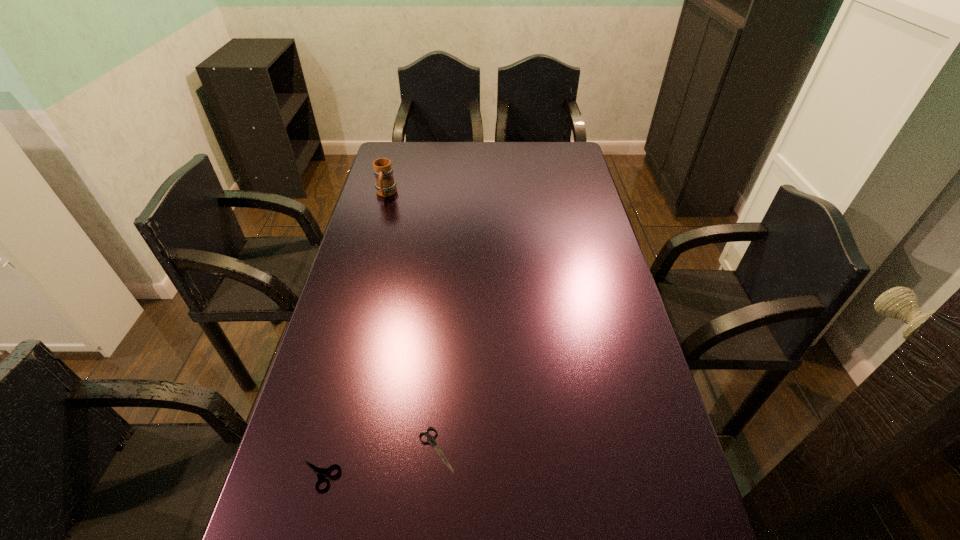
Locate an element on the screen. free space between the tallest object and the shorter shears is located at coordinates (411, 321).

Identify the location of vacant space in between the taller shears and the farthest object. The image size is (960, 540). (353, 335).

Identify the location of vacant point located between the taller shears and the shorter shears. (378, 463).

Where is `vacant space that is in between the farthest object and the left shears`? This screenshot has height=540, width=960. vacant space that is in between the farthest object and the left shears is located at coordinates (353, 335).

The width and height of the screenshot is (960, 540). I want to click on the second closest object to the taller shears, so click(x=385, y=185).

Select which object is the closest to the taller shears. Please provide its 2D coordinates. Your answer should be formatted as a tuple, i.e. [(x, y)], where the tuple contains the x and y coordinates of a point satisfying the conditions above.

[(430, 439)]

Find the location of a particular element. The width and height of the screenshot is (960, 540). vacant position in the image that satisfies the following two spatial constraints: 1. on the side of the right shears with the handle; 2. on the right side of the mug is located at coordinates (316, 449).

Where is `vacant position in the image that satisfies the following two spatial constraints: 1. on the side of the right shears with the handle; 2. on the right side of the farthest object`? This screenshot has width=960, height=540. vacant position in the image that satisfies the following two spatial constraints: 1. on the side of the right shears with the handle; 2. on the right side of the farthest object is located at coordinates (316, 449).

Identify the location of free space that satisfies the following two spatial constraints: 1. on the side of the tallest object with the handle; 2. on the right side of the shorter shears. (316, 449).

Identify the location of free space that satisfies the following two spatial constraints: 1. on the side of the mug with the handle; 2. on the left side of the taller shears. (309, 476).